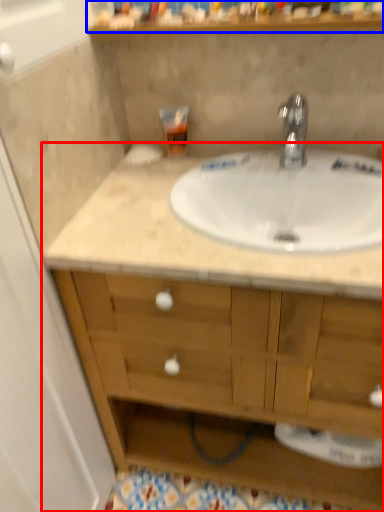
Question: Which point is closer to the camera, bathroom cabinet (highlighted by a red box) or shelf (highlighted by a blue box)?

Choices:
 (A) bathroom cabinet
 (B) shelf

Answer: (A)